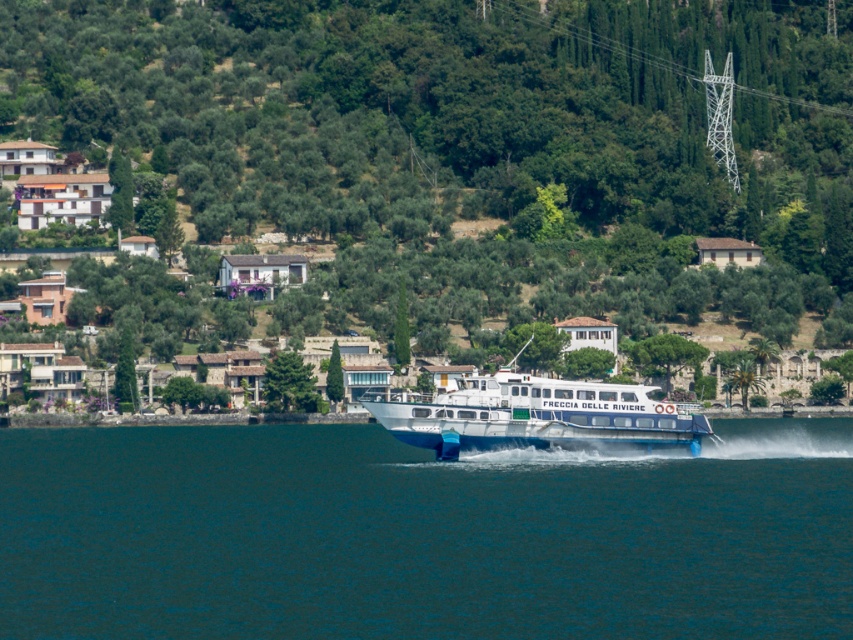
You are standing at the point closer to the camera between point [583,454] and point [527,435]. Which point are you at?

→ You are at point [583,454] because it is further to the camera than point [527,435].

You are a drone operator tasked with capturing aerial footage of the coastal area. You need to fly your drone from the white metallic tower at upper center to the blue water at center. What is the approximate distance you need to cover?

The distance between the white metallic tower at upper center and the blue water at center is approximately 225.55 meters, so the drone operator needs to cover around 225.55 meters.